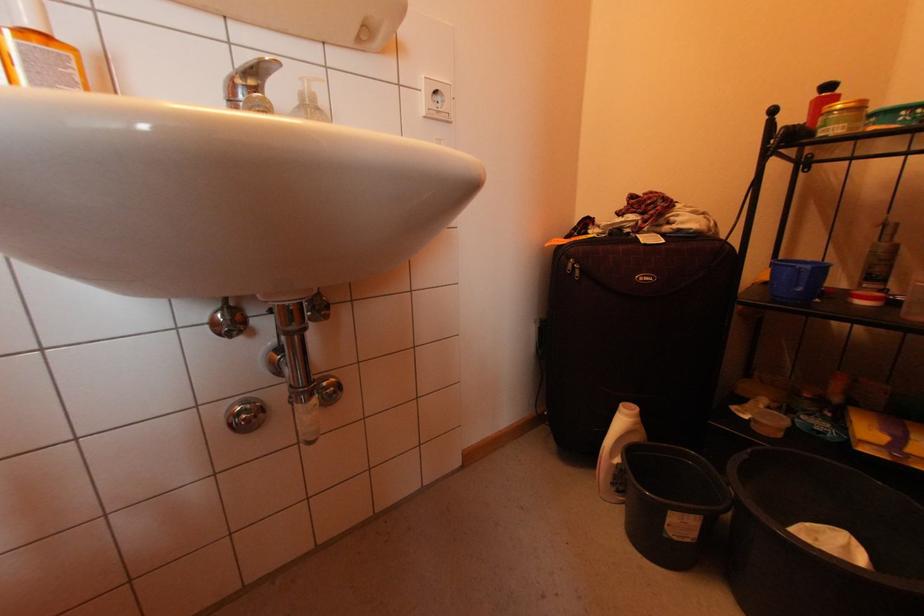
The height and width of the screenshot is (616, 924). In order to click on zipper pull in this screenshot , I will do `click(574, 268)`.